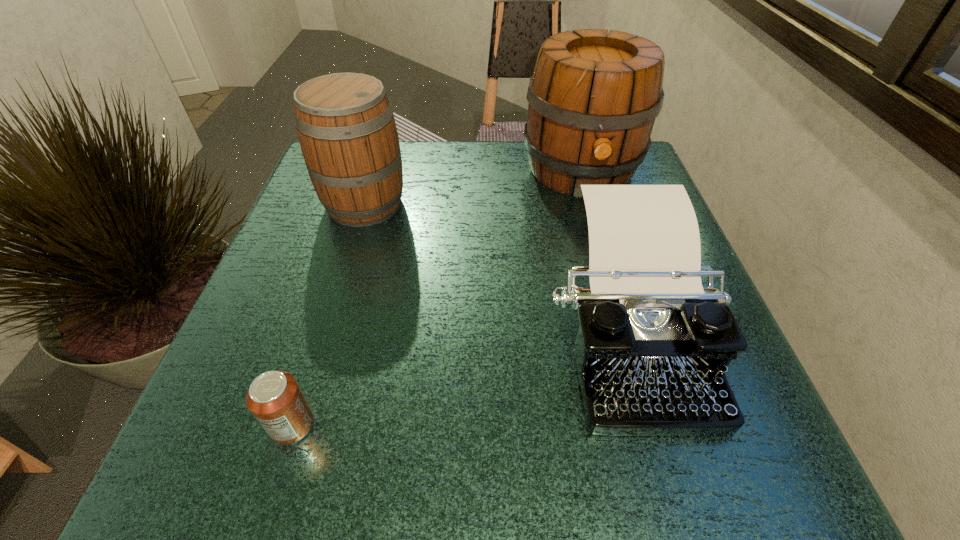
Identify the location of cider that is positioned at the left edge. The width and height of the screenshot is (960, 540). (345, 123).

This screenshot has width=960, height=540. I want to click on can located in the left edge section of the desktop, so click(275, 399).

Identify the location of cider located at the right edge. The width and height of the screenshot is (960, 540). (593, 98).

Identify the location of typewriter that is at the right edge. The image size is (960, 540). (652, 348).

Locate an element on the screen. object that is positioned at the far left corner is located at coordinates (345, 123).

The height and width of the screenshot is (540, 960). I want to click on object at the near left corner, so click(x=275, y=399).

Locate an element on the screen. object at the far right corner is located at coordinates (593, 98).

Where is `object positioned at the near right corner`? The image size is (960, 540). object positioned at the near right corner is located at coordinates (652, 348).

Where is `vacant space at the far edge`? Image resolution: width=960 pixels, height=540 pixels. vacant space at the far edge is located at coordinates (479, 173).

What are the coordinates of `vacant space at the near edge of the desktop` in the screenshot? It's located at (472, 463).